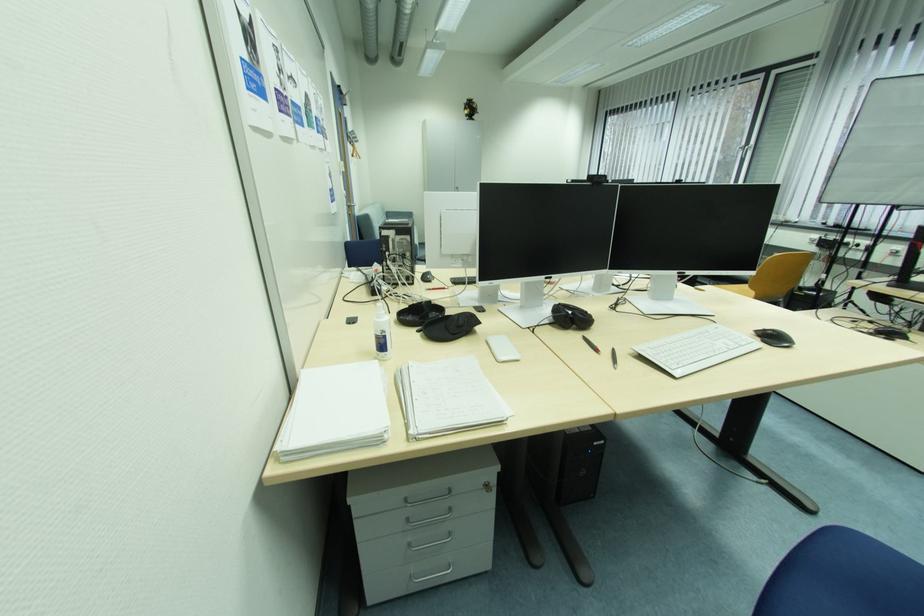
I want to click on sofa sitting surface, so click(397, 227).